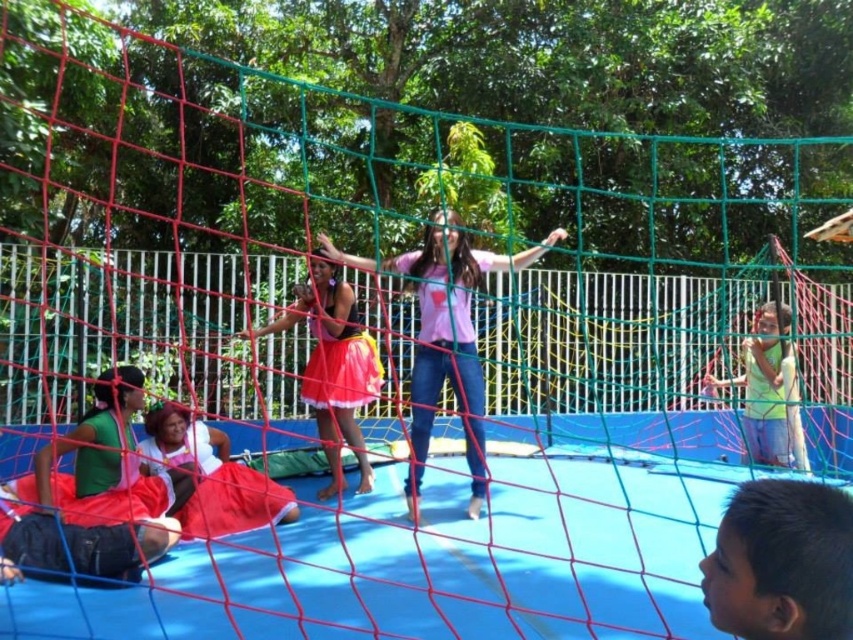
Which is more to the right, pink matte skirt at center or pink satin skirt at center?

pink matte skirt at center is more to the right.

Does point (479, 416) come in front of point (329, 326)?

Yes, point (479, 416) is closer to viewer.

Who is more distant from viewer, [431,291] or [340,420]?

Point [340,420]

Identify the location of pink matte skirt at center. This screenshot has width=853, height=640. (445, 333).

Based on the photo, can you confirm if pink satin skirt at center is positioned above matte red dress at lower left?

Yes, pink satin skirt at center is above matte red dress at lower left.

Is pink satin skirt at center taller than matte red dress at lower left?

Yes.

Is point (334, 476) farther from viewer compared to point (170, 406)?

Yes, it is.

Where is `pink satin skirt at center`? Image resolution: width=853 pixels, height=640 pixels. pink satin skirt at center is located at coordinates (334, 365).

Who is positioned more to the left, pink satin skirt at center or green matte shirt at upper right?

Positioned to the left is pink satin skirt at center.

Is pink satin skirt at center above green matte shirt at upper right?

Indeed, pink satin skirt at center is positioned over green matte shirt at upper right.

Image resolution: width=853 pixels, height=640 pixels. Describe the element at coordinates (334, 365) in the screenshot. I see `pink satin skirt at center` at that location.

In order to click on pink satin skirt at center in this screenshot , I will do `click(334, 365)`.